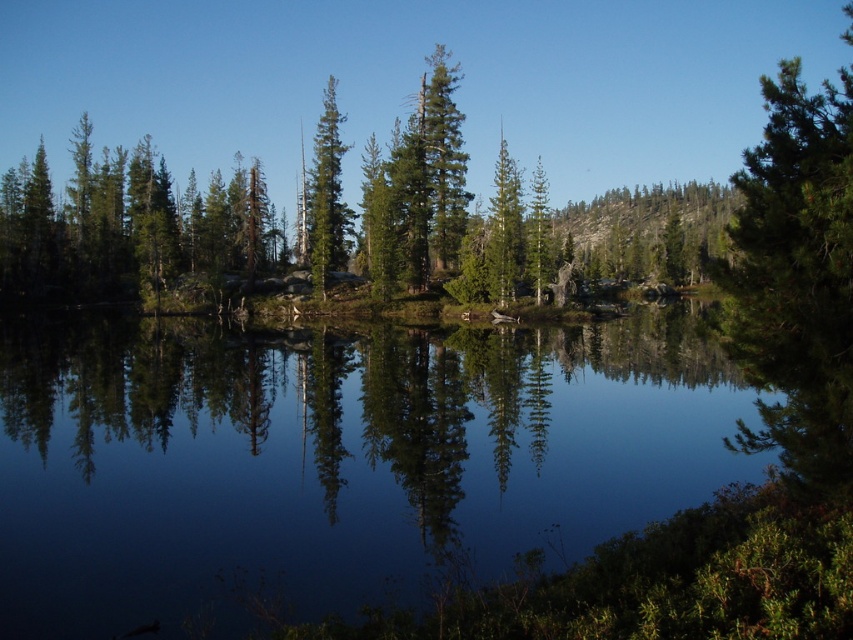
You are a drone operator trying to capture the reflection of the trees in the transparent water at center. According to the coordinates provided, where should you position the drone to ensure it captures the reflection clearly?

The transparent water at center is located at coordinates point (335,461), so positioning the drone at this point will ensure it captures the reflection clearly.

You are standing on the shore and want to take a photo of the green matte tree at center and the transparent water at center. Which object should you focus on first if you want both to be in sharp focus?

You should focus on the green matte tree at center first because it is closer to you than the transparent water at center, which is further away. This technique ensures that both objects will be in focus due to the depth of field extending from the tree to the water.